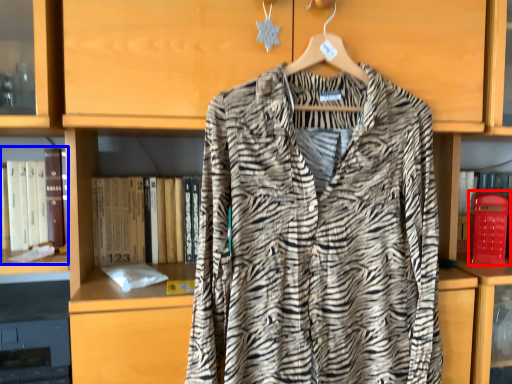
Question: Which of the following is the farthest to the observer, phone box (highlighted by a red box) or book (highlighted by a blue box)?

Choices:
 (A) phone box
 (B) book

Answer: (A)